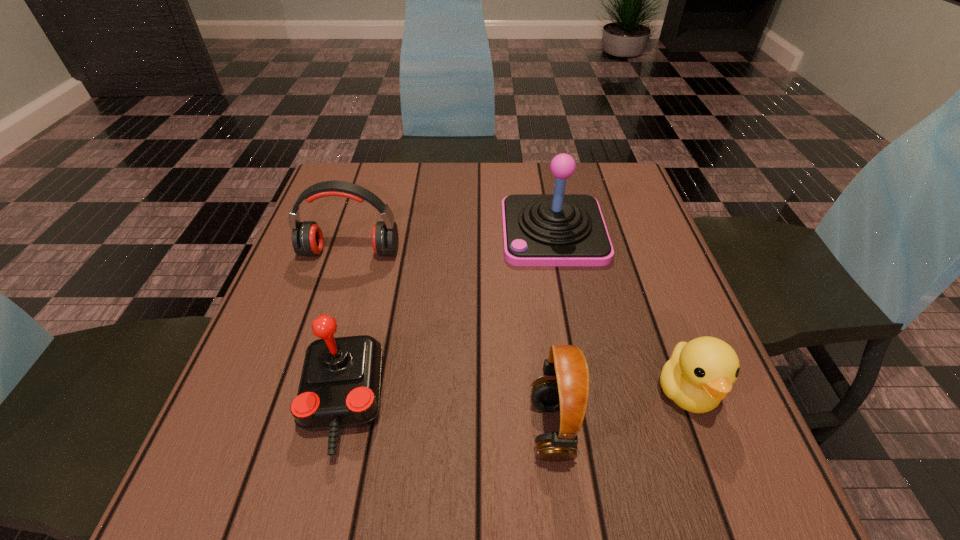
Identify the location of vacant region located forward from the base of the farther joystick. (453, 232).

What are the coordinates of `blank space located on the ear cups of the earphone` in the screenshot? It's located at (323, 343).

You are a GUI agent. You are given a task and a screenshot of the screen. Output one action in this format:
    pyautogui.click(x=<x>, y=<y>)
    Task: Click on the free space located 0.130m on the ear cups of the headset
    The image size is (960, 540).
    Given the screenshot: What is the action you would take?
    pyautogui.click(x=450, y=428)

Where is `free space located on the ear cups of the headset`? free space located on the ear cups of the headset is located at coordinates (301, 428).

The height and width of the screenshot is (540, 960). I want to click on free space located 0.150m on the ear cups of the headset, so click(438, 428).

I want to click on vacant space located on the left of the nearer joystick, so click(x=271, y=402).

Where is `object that is at the far edge`? This screenshot has height=540, width=960. object that is at the far edge is located at coordinates (558, 229).

Locate an element on the screen. The image size is (960, 540). headset that is at the near edge is located at coordinates (564, 386).

Find the location of `joystick situated at the near edge`. joystick situated at the near edge is located at coordinates (339, 388).

Identify the location of earphone that is at the left edge. The height and width of the screenshot is (540, 960). (307, 239).